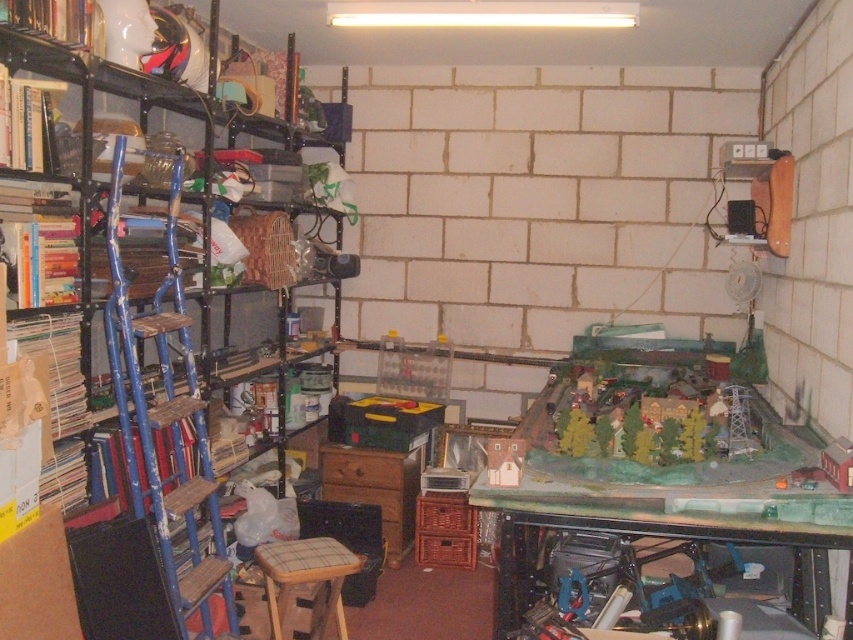
You are standing in the cluttered workspace described. You need to place a small object on the green matte table at center. Based on the coordinates provided, can you confirm if the point marked at (664, 522) is indeed on the green matte table at center?

Yes, the point marked at (664, 522) corresponds to the green matte table at center, so placing the object there would be accurate.

You are organizing a small gathering in this workspace and need to seat four people. You have the green matte table at center and the wooden stool at center. Can both the table and stool accommodate all four guests comfortably?

The green matte table at center is bigger than the wooden stool at center, so it can likely accommodate more people. However, since there is only one stool, it may not be sufficient to seat four guests comfortably. Consider adding more seating options.

You have a large project that requires a workspace wider than the metallic blue ladder at left. Can the green matte table at center accommodate it?

The green matte table at center has a larger width than the metallic blue ladder at left, so it can accommodate the project that requires a workspace wider than the ladder.